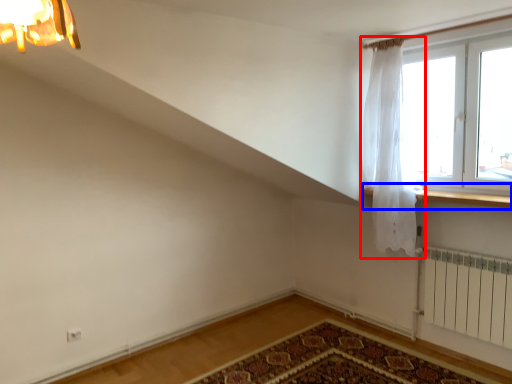
Question: Which object appears closest to the camera in this image, curtain (highlighted by a red box) or window sill (highlighted by a blue box)?

Choices:
 (A) curtain
 (B) window sill

Answer: (B)